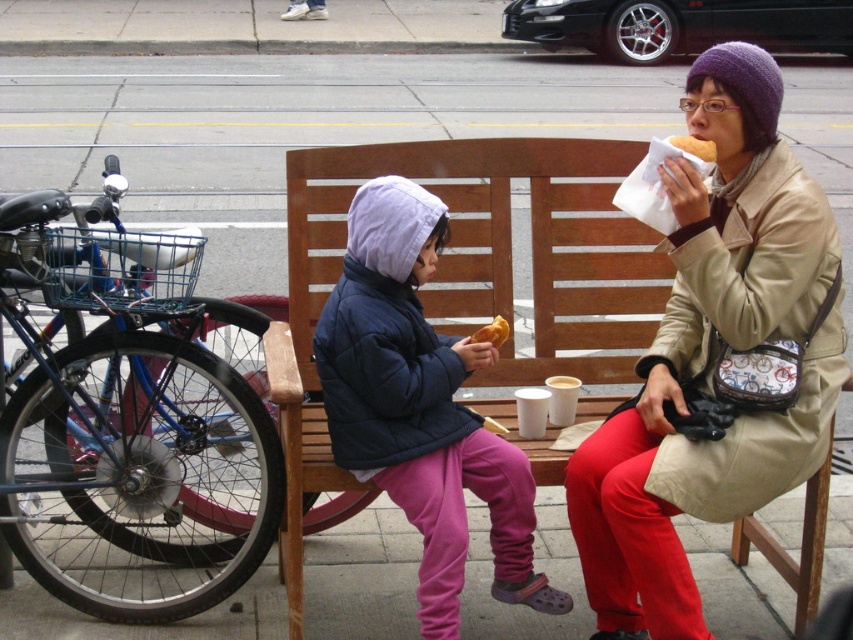
Does wooden bench at center have a larger size compared to golden bread at center?

Indeed, wooden bench at center has a larger size compared to golden bread at center.

Identify the location of wooden bench at center. Image resolution: width=853 pixels, height=640 pixels. (466, 278).

Can you confirm if matte blue jacket at center is taller than golden bread at center?

Yes, matte blue jacket at center is taller than golden bread at center.

Is matte blue jacket at center further to the viewer compared to golden bread at center?

No, matte blue jacket at center is closer to the viewer.

Measure the distance between point [486,490] and camera.

A distance of 3.02 meters exists between point [486,490] and camera.

This screenshot has width=853, height=640. Find the location of `matte blue jacket at center`. matte blue jacket at center is located at coordinates (421, 406).

Can you confirm if matte blue jacket at center is positioned to the right of golden bread at upper center?

In fact, matte blue jacket at center is to the left of golden bread at upper center.

At what (x,y) coordinates should I click in order to perform the action: click on matte blue jacket at center. Please return your answer as a coordinate pair (x, y). The width and height of the screenshot is (853, 640). Looking at the image, I should click on (421, 406).